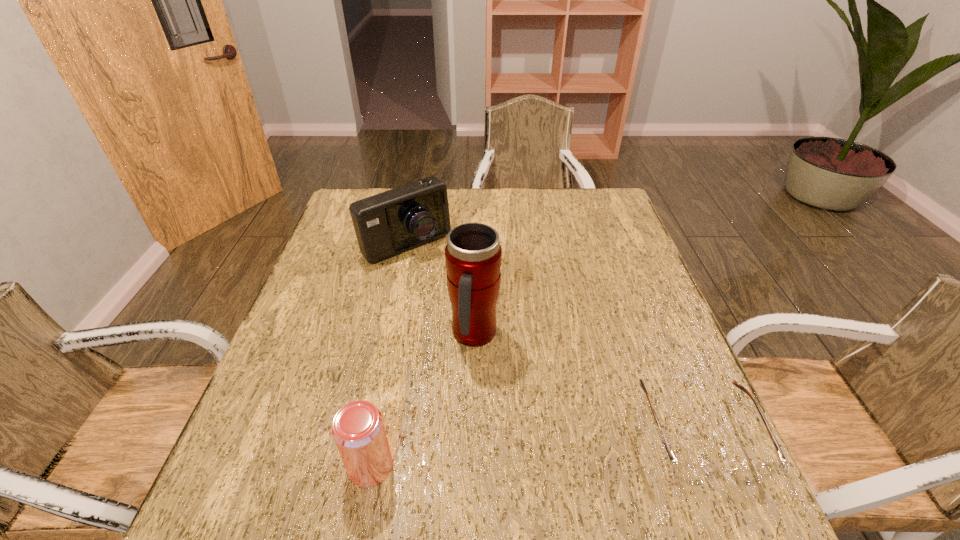
In order to click on vacant space located on the front-facing side of the second tallest object in this screenshot , I will do `click(469, 312)`.

Locate an element on the screen. vacant region located 0.050m on the side with the handle of the tallest object is located at coordinates (499, 373).

Find the location of a particular element. This screenshot has height=540, width=960. free spot located on the side with the handle of the tallest object is located at coordinates (522, 403).

Find the location of a particular element. vacant space located on the side with the handle of the tallest object is located at coordinates (522, 403).

Where is `object present at the far edge`? object present at the far edge is located at coordinates (386, 224).

Find the location of a particular element. beer can at the near edge is located at coordinates (358, 430).

Identify the location of spectacles at the near edge. This screenshot has width=960, height=540. (691, 473).

This screenshot has width=960, height=540. Find the location of `object present at the left edge`. object present at the left edge is located at coordinates (386, 224).

Where is `object that is at the right edge`? object that is at the right edge is located at coordinates (691, 473).

Where is `object that is at the far left corner`? The image size is (960, 540). object that is at the far left corner is located at coordinates (386, 224).